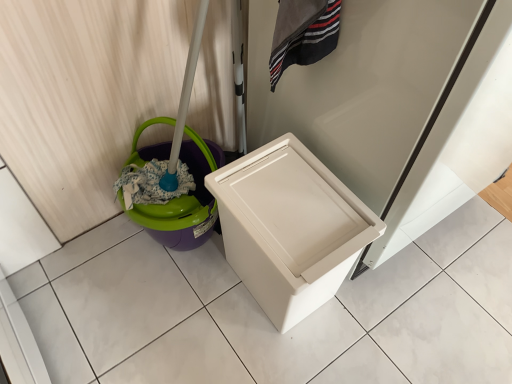
This screenshot has height=384, width=512. What do you see at coordinates (289, 228) in the screenshot?
I see `white plastic waste container at center` at bounding box center [289, 228].

Where is `white plastic waste container at center`? white plastic waste container at center is located at coordinates (289, 228).

This screenshot has width=512, height=384. Describe the element at coordinates (183, 201) in the screenshot. I see `purple plastic potty at left` at that location.

Where is `purple plastic potty at left`? The height and width of the screenshot is (384, 512). purple plastic potty at left is located at coordinates (183, 201).

Locate an element on the screen. The width and height of the screenshot is (512, 384). white plastic waste container at center is located at coordinates [x=289, y=228].

Considering the positions of objects purple plastic potty at left and white plastic waste container at center in the image provided, who is more to the right, purple plastic potty at left or white plastic waste container at center?

white plastic waste container at center.

Which object is further away from the camera taking this photo, purple plastic potty at left or white plastic waste container at center?

purple plastic potty at left is behind.

Is point (132, 156) less distant than point (266, 255)?

That is False.

From the image's perspective, between purple plastic potty at left and white plastic waste container at center, who is located below?

white plastic waste container at center.

From a real-world perspective, is purple plastic potty at left physically below white plastic waste container at center?

Yes, from a real-world perspective, purple plastic potty at left is below white plastic waste container at center.

Looking at their sizes, would you say purple plastic potty at left is wider or thinner than white plastic waste container at center?

Considering their sizes, purple plastic potty at left looks slimmer than white plastic waste container at center.

Considering the sizes of objects purple plastic potty at left and white plastic waste container at center in the image provided, who is taller, purple plastic potty at left or white plastic waste container at center?

white plastic waste container at center is taller.

Does purple plastic potty at left have a smaller size compared to white plastic waste container at center?

Yes.

In the scene shown: Is purple plastic potty at left spatially inside white plastic waste container at center, or outside of it?

purple plastic potty at left cannot be found inside white plastic waste container at center.

Is purple plastic potty at left touching white plastic waste container at center?

No, purple plastic potty at left is not next to white plastic waste container at center.

Is purple plastic potty at left turned away from white plastic waste container at center?

No.

How different are the orientations of purple plastic potty at left and white plastic waste container at center in degrees?

5.27e-05 degrees.

Locate an element on the screen. The width and height of the screenshot is (512, 384). potty that appears on the left of white plastic waste container at center is located at coordinates (183, 201).

Considering the positions of objects white plastic waste container at center and purple plastic potty at left in the image provided, who is more to the left, white plastic waste container at center or purple plastic potty at left?

purple plastic potty at left is more to the left.

Which object is closer to the camera, white plastic waste container at center or purple plastic potty at left?

white plastic waste container at center is closer to the camera.

Is point (302, 268) closer or farther from the camera than point (203, 234)?

Point (302, 268) is closer to the camera than point (203, 234).

Looking at this image, from the image's perspective, is white plastic waste container at center located above or below purple plastic potty at left?

A: white plastic waste container at center is below purple plastic potty at left.

From a real-world perspective, which is physically above, white plastic waste container at center or purple plastic potty at left?

white plastic waste container at center is physically above.

Considering the sizes of white plastic waste container at center and purple plastic potty at left in the image, is white plastic waste container at center wider or thinner than purple plastic potty at left?

white plastic waste container at center is wider than purple plastic potty at left.

Who is taller, white plastic waste container at center or purple plastic potty at left?

With more height is white plastic waste container at center.

Who is bigger, white plastic waste container at center or purple plastic potty at left?

white plastic waste container at center.

Does white plastic waste container at center contain purple plastic potty at left?

No, purple plastic potty at left is not surrounded by white plastic waste container at center.

Is there a large distance between white plastic waste container at center and purple plastic potty at left?

No, white plastic waste container at center is not far from purple plastic potty at left.

Is white plastic waste container at center aimed at purple plastic potty at left?

No, white plastic waste container at center does not turn towards purple plastic potty at left.

Can you tell me how much white plastic waste container at center and purple plastic potty at left differ in facing direction?

The facing directions of white plastic waste container at center and purple plastic potty at left are 5.27e-05 degrees apart.

Identify the location of potty behind the white plastic waste container at center. (183, 201).

Where is `potty behind the white plastic waste container at center`? potty behind the white plastic waste container at center is located at coordinates (183, 201).

Locate an element on the screen. waste container on the right of purple plastic potty at left is located at coordinates (289, 228).